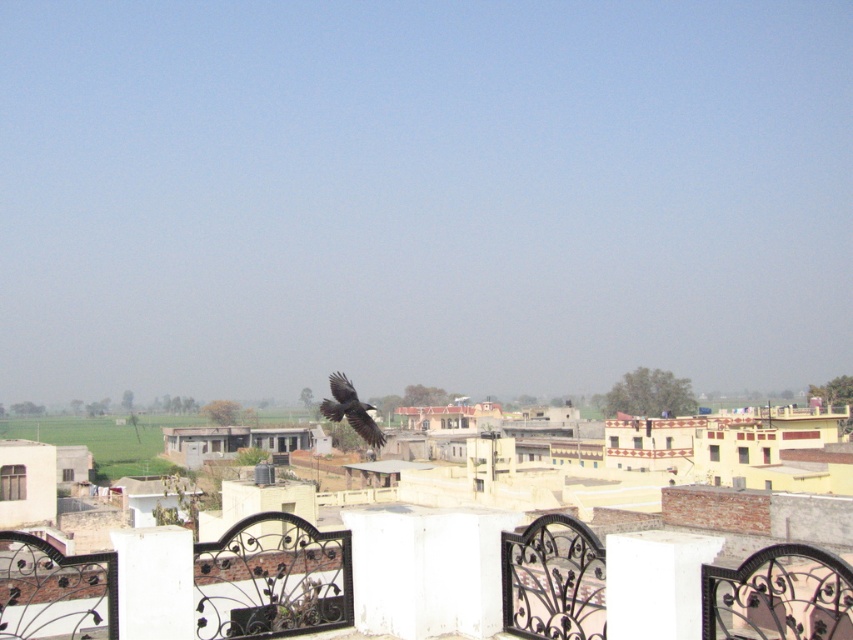
You are an architect designing a new balcony railing system. You observe the white smooth pillar at center and the black glossy crow at center in the image. Which object should you reference for the scale of the main support pillar in your design?

The white smooth pillar at center has a smaller size compared to the black glossy crow at center, so you should reference the white smooth pillar at center for the scale of the main support pillar in your design since it is smaller and likely more appropriate for a balcony structure.

You are a delivery drone carrying a package that requires a minimum of 5 meters of clearance to safely descend. You are currently hovering above the black wrought iron fence at lower center and need to land near the white painted concrete pillar at center. Based on the scene, can you safely land there?

The distance between the black wrought iron fence at lower center and the white painted concrete pillar at center is 6.92 meters, which exceeds the required 5 meters of clearance. Therefore, the delivery drone can safely land near the white painted concrete pillar at center.

From the picture: You are standing on the balcony and want to look towards the buildings. Which point, point (650, 604) or point (349, 416), is closer to you?

Point (650, 604) is in front of point (349, 416), so it is closer to you.